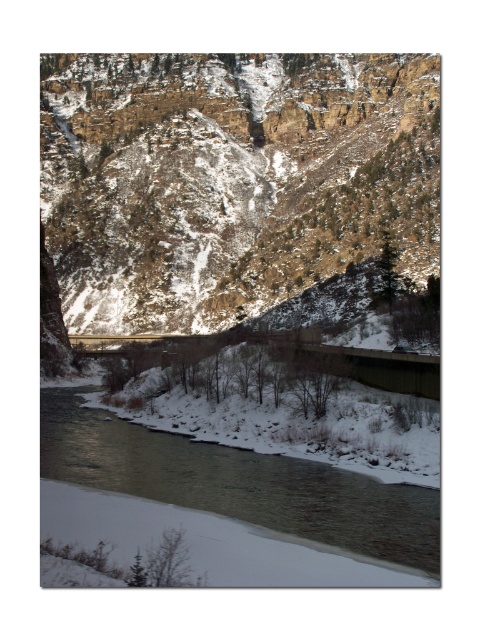
Question: Can you confirm if rocky brown cliff at center is positioned below snowy river at lower center?

Choices:
 (A) no
 (B) yes

Answer: (A)

Question: Does rocky brown cliff at center come in front of snowy river at lower center?

Choices:
 (A) yes
 (B) no

Answer: (B)

Question: Can you confirm if rocky brown cliff at center is wider than snowy river at lower center?

Choices:
 (A) no
 (B) yes

Answer: (B)

Question: Which of the following is the farthest from the observer?

Choices:
 (A) (72, 477)
 (B) (132, 156)

Answer: (B)

Question: Which point is closer to the camera taking this photo?

Choices:
 (A) (219, 253)
 (B) (376, 504)

Answer: (B)